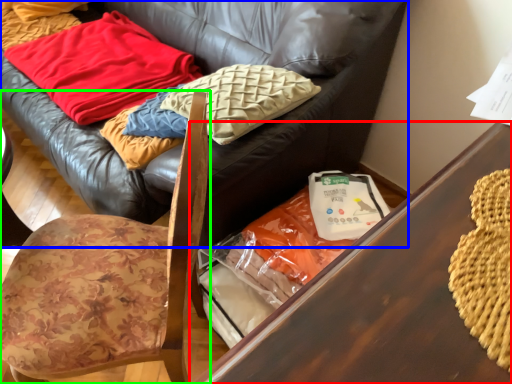
Question: Estimate the real-world distances between objects in this image. Which object is closer to table (highlighted by a red box), studio couch (highlighted by a blue box) or chair (highlighted by a green box)?

Choices:
 (A) studio couch
 (B) chair

Answer: (B)